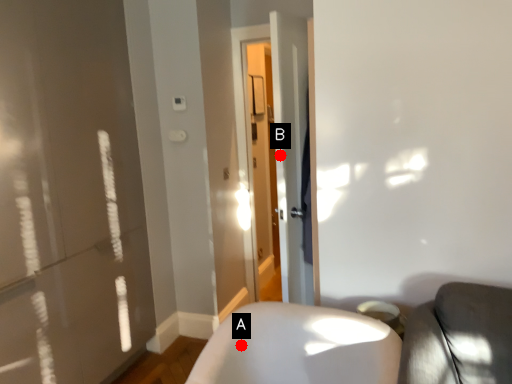
Question: Two points are circled on the image, labeled by A and B beside each circle. Which point is closer to the camera?

Choices:
 (A) A is closer
 (B) B is closer

Answer: (A)